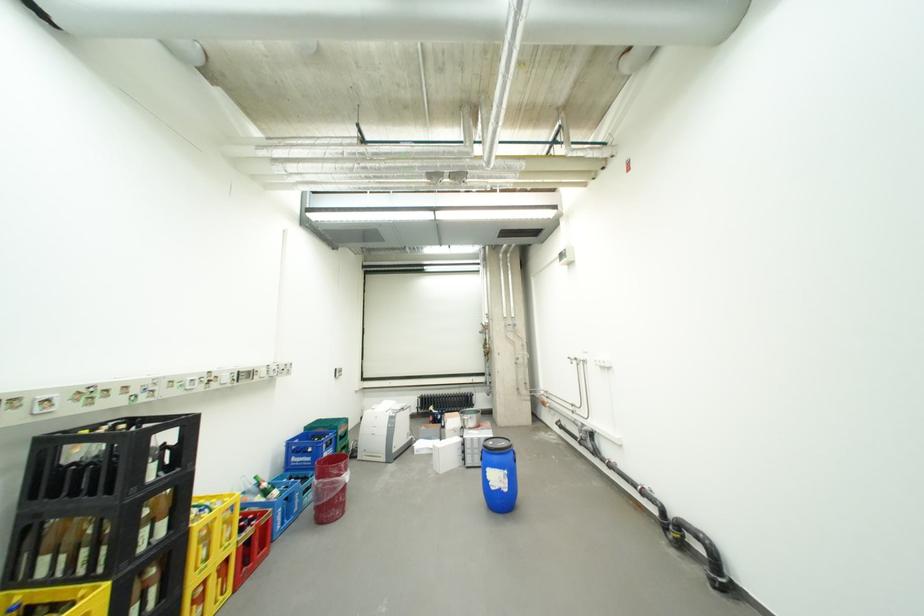
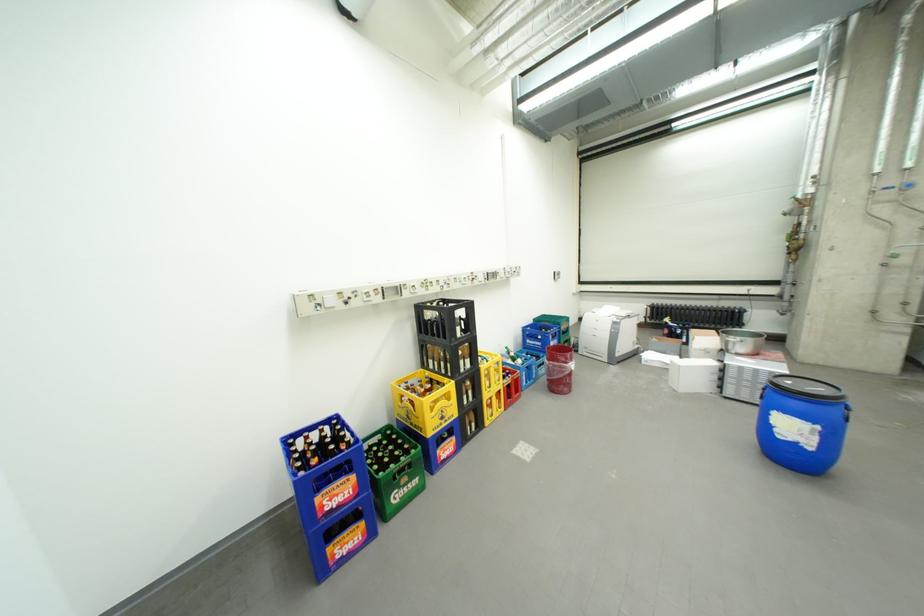
Where in the second image is the point corresponding to (x=168, y=472) from the first image?

(470, 333)